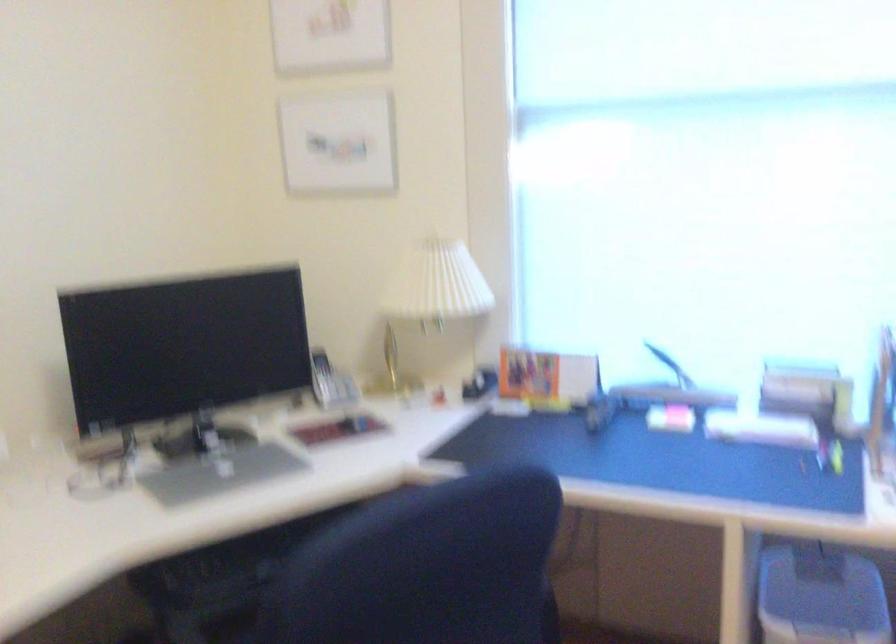
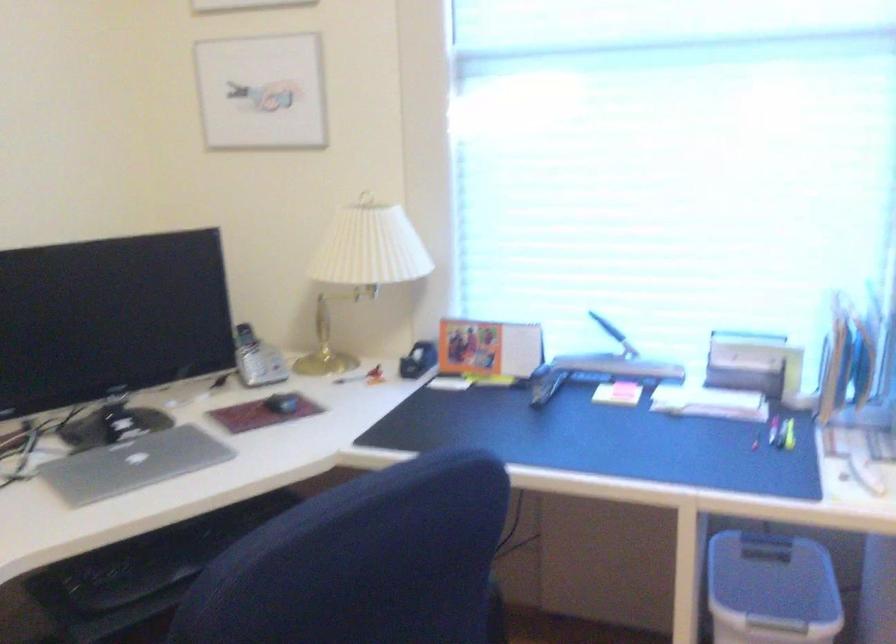
In the second image, find the point that corresponds to (352,424) in the first image.

(281, 402)